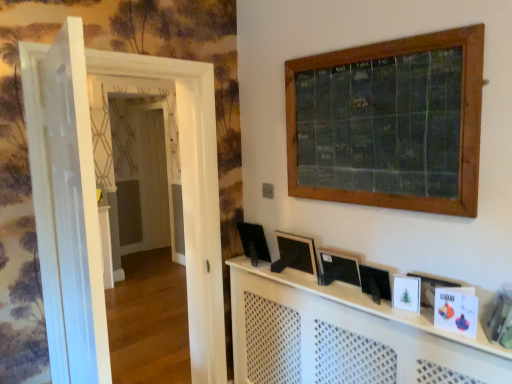
Locate an element on the screen. This screenshot has width=512, height=384. vacant space to the left of black matte picture frame at center, the second picture frame from the left is located at coordinates (349, 297).